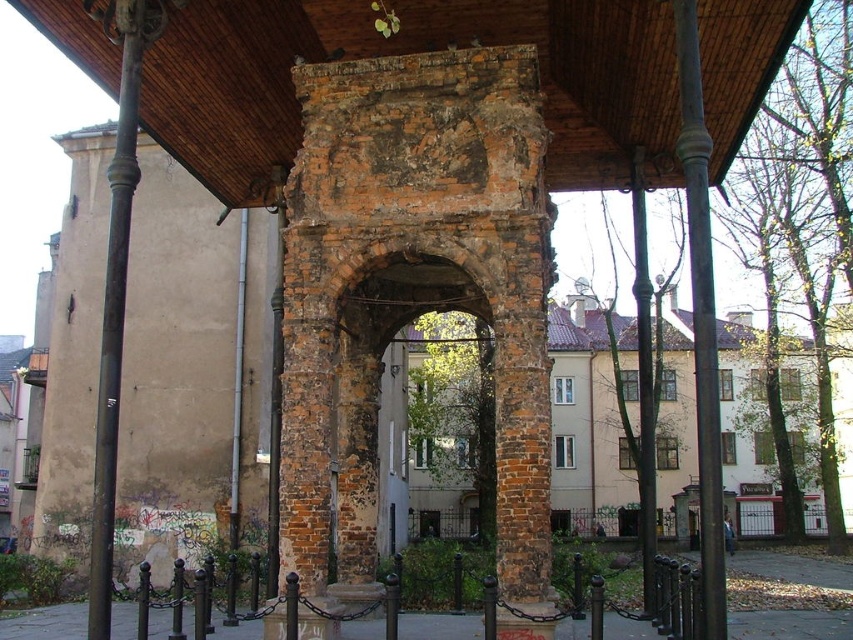
You are a maintenance worker assessing the height of the wooden at center and the smooth dark brown post at right. Which one is shorter?

The wooden at center is shorter than the smooth dark brown post at right.

You are a visitor standing in front of the archway and want to touch both the wooden at center and the smooth dark brown post at right. Which one should you reach for first if you want to touch the one on the left side first?

The wooden at center is to the left of the smooth dark brown post at right, so you should reach for the wooden at center first.